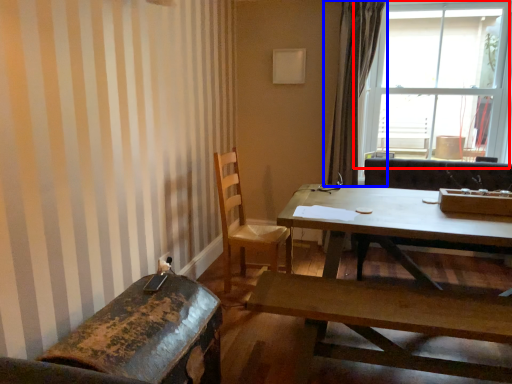
Question: Which object appears closest to the camera in this image, window (highlighted by a red box) or curtain (highlighted by a blue box)?

Choices:
 (A) window
 (B) curtain

Answer: (A)